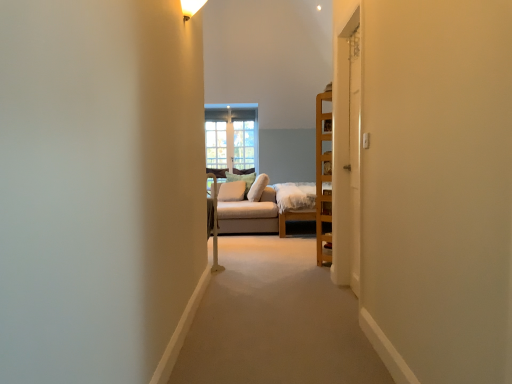
Question: Considering the relative sizes of white painted wood door at right, the 2th door positioned from the left, and clear glass window at center in the image provided, is white painted wood door at right, the 2th door positioned from the left, wider than clear glass window at center?

Choices:
 (A) no
 (B) yes

Answer: (B)

Question: Is white painted wood door at right, positioned as the first door in right-to-left order, to the left of clear glass window at center from the viewer's perspective?

Choices:
 (A) no
 (B) yes

Answer: (A)

Question: Is the depth of white painted wood door at right, the 2th door positioned from the left, less than that of clear glass window at center?

Choices:
 (A) yes
 (B) no

Answer: (A)

Question: Is white painted wood door at right, the 2th door positioned from the left, not close to clear glass window at center?

Choices:
 (A) no
 (B) yes

Answer: (B)

Question: From a real-world perspective, is white painted wood door at right, positioned as the first door in right-to-left order, beneath clear glass window at center?

Choices:
 (A) yes
 (B) no

Answer: (A)

Question: Relative to soft beige cushion at center, marked as the second pillow in a back-to-front arrangement, is white wooden door at center, the 2th door viewed from the right, in front or behind?

Choices:
 (A) behind
 (B) front

Answer: (B)

Question: From the image's perspective, is white wooden door at center, which is the 1th door from left to right, above or below soft beige cushion at center, marked as the second pillow in a back-to-front arrangement?

Choices:
 (A) below
 (B) above

Answer: (B)

Question: Does point (343, 269) appear closer or farther from the camera than point (223, 190)?

Choices:
 (A) closer
 (B) farther

Answer: (A)

Question: Based on their sizes in the image, would you say white wooden door at center, the 2th door viewed from the right, is bigger or smaller than soft beige cushion at center, marked as the second pillow in a back-to-front arrangement?

Choices:
 (A) big
 (B) small

Answer: (A)

Question: From a real-world perspective, is soft beige pillow at center, which ranks as the 2th pillow in front-to-back order, above or below white wooden door at center, the 2th door viewed from the right?

Choices:
 (A) above
 (B) below

Answer: (B)

Question: Does point (246, 188) appear closer or farther from the camera than point (350, 61)?

Choices:
 (A) closer
 (B) farther

Answer: (B)

Question: Visually, is soft beige pillow at center, which ranks as the 2th pillow in front-to-back order, positioned to the left or to the right of white wooden door at center, which is the 1th door from left to right?

Choices:
 (A) right
 (B) left

Answer: (B)

Question: From the image's perspective, is soft beige pillow at center, the first pillow when ordered from back to front, located above or below white wooden door at center, the 2th door viewed from the right?

Choices:
 (A) above
 (B) below

Answer: (B)

Question: Considering the positions of white painted wood door at right, positioned as the first door in right-to-left order, and white wooden door at center, the 2th door viewed from the right, in the image, is white painted wood door at right, positioned as the first door in right-to-left order, bigger or smaller than white wooden door at center, the 2th door viewed from the right,?

Choices:
 (A) small
 (B) big

Answer: (A)

Question: Does point coord(352,274) appear closer or farther from the camera than point coord(342,157)?

Choices:
 (A) farther
 (B) closer

Answer: (B)